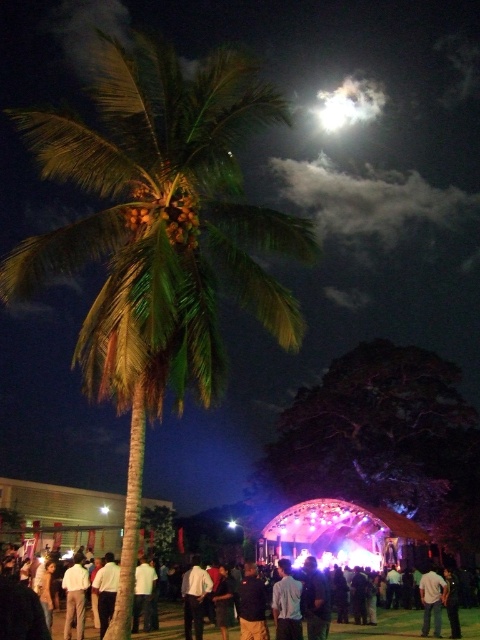
From the picture: Who is lower down, light blue shirt at center or light brown fabric shirt at lower left?

light brown fabric shirt at lower left is below.

Which is in front, point (297, 625) or point (71, 582)?

Point (297, 625) is more forward.

Image resolution: width=480 pixels, height=640 pixels. I want to click on light blue shirt at center, so click(x=287, y=604).

Who is positioned more to the left, dark fabric crowd at center or white matte shirt at center?

From the viewer's perspective, white matte shirt at center appears more on the left side.

Describe the element at coordinates (382, 627) in the screenshot. The width and height of the screenshot is (480, 640). I see `dark fabric crowd at center` at that location.

The height and width of the screenshot is (640, 480). What are the coordinates of `dark fabric crowd at center` in the screenshot? It's located at (382, 627).

Does light brown fabric shirt at lower left appear under white matte shirt at lower right?

No, light brown fabric shirt at lower left is not below white matte shirt at lower right.

Is light brown fabric shirt at lower left shorter than white matte shirt at lower right?

Yes, light brown fabric shirt at lower left is shorter than white matte shirt at lower right.

Is point (67, 628) closer to camera compared to point (444, 593)?

Yes, it is in front of point (444, 593).

Where is `light brown fabric shirt at lower left`? Image resolution: width=480 pixels, height=640 pixels. light brown fabric shirt at lower left is located at coordinates (74, 596).